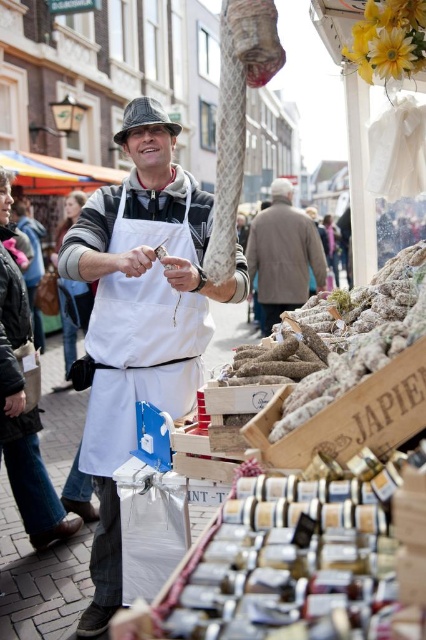
Question: Is white apron at center below brown woolen coat at center?

Choices:
 (A) no
 (B) yes

Answer: (B)

Question: Is white apron at center thinner than brown woolen coat at center?

Choices:
 (A) yes
 (B) no

Answer: (A)

Question: Which point is closer to the camera?

Choices:
 (A) white apron at center
 (B) brown woolen coat at center

Answer: (A)

Question: Does white canvas apron at center appear on the right side of brown woolen coat at center?

Choices:
 (A) yes
 (B) no

Answer: (B)

Question: Which object is farther from the camera taking this photo?

Choices:
 (A) white canvas apron at center
 (B) brown woolen coat at center
 (C) white apron at center

Answer: (B)

Question: Which point is closer to the camera?

Choices:
 (A) white apron at center
 (B) brown woolen coat at center
 (C) white canvas apron at center

Answer: (A)